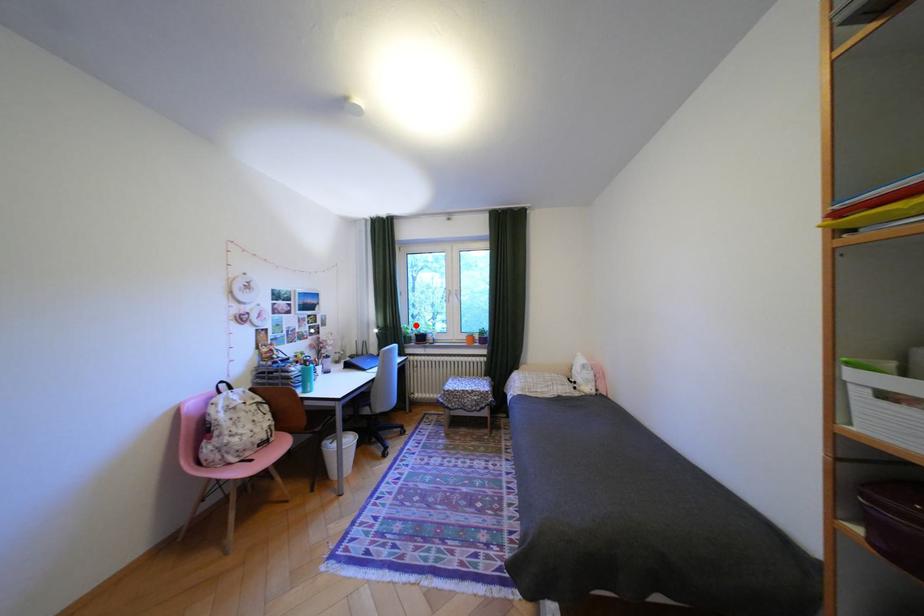
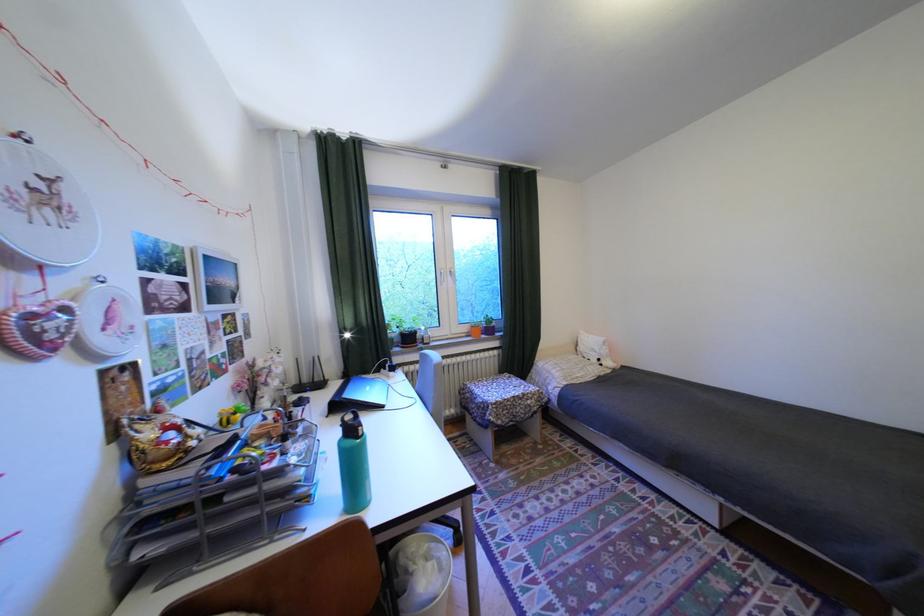
Locate, in the second image, the point that corresponds to the highlighted location in the first image.

(397, 322)